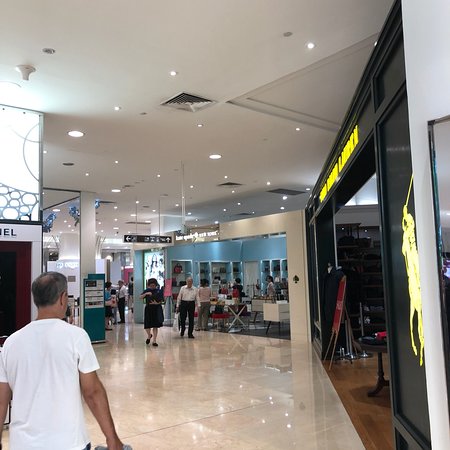
The height and width of the screenshot is (450, 450). Find the location of `ceiling`. ceiling is located at coordinates (150, 154).